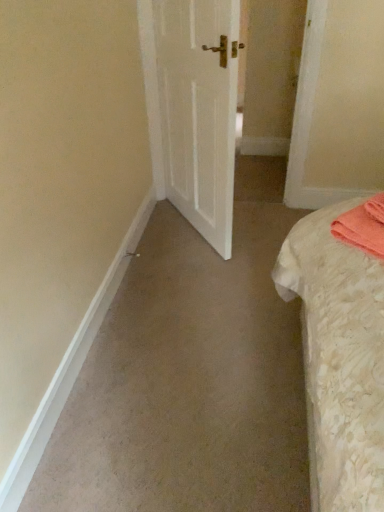
Question: Should I look upward or downward to see white matte door at center?

Choices:
 (A) down
 (B) up

Answer: (B)